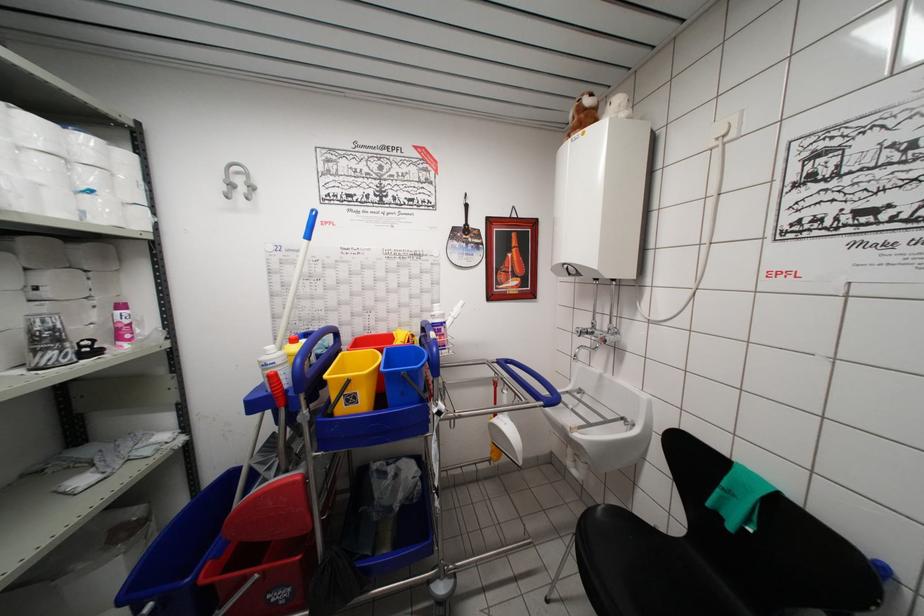
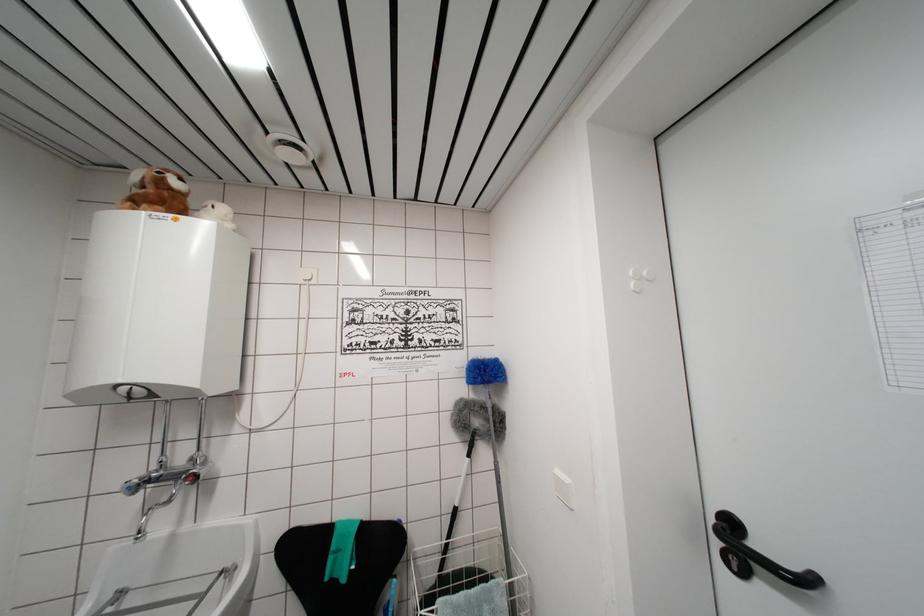
Locate, in the second image, the point that corresponds to [608,339] in the first image.

(197, 476)